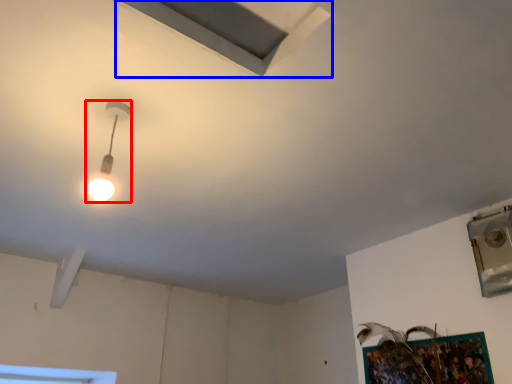
Question: Which object is further to the camera taking this photo, lamp (highlighted by a red box) or exhaust hood (highlighted by a blue box)?

Choices:
 (A) lamp
 (B) exhaust hood

Answer: (A)